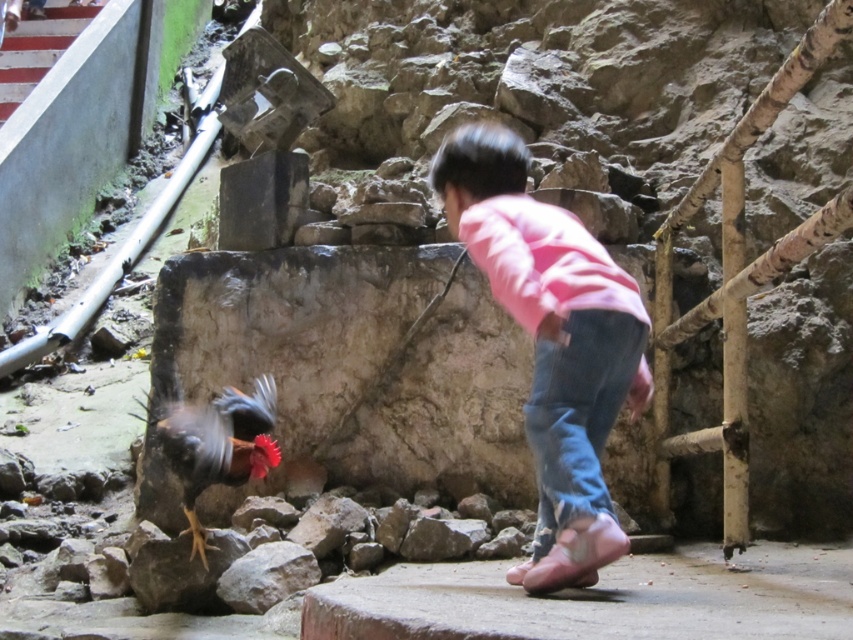
You are a photographer trying to capture the child in the scene. The pink cotton shirt at center and blue denim jeans at lower center are both visible in the frame. Which clothing item is positioned higher relative to the other?

The pink cotton shirt at center is much taller than blue denim jeans at lower center, so the pink cotton shirt at center is positioned higher.

You are a photographer trying to capture the pink cotton shirt at center and the multicolored feathered rooster at center in the same frame. Since the shirt is covering part of the rooster, can you adjust your camera angle to show both clearly without moving any objects?

The pink cotton shirt at center is positioned over the multicolored feathered rooster at center. To capture both clearly, you can lower your camera angle to shoot from below, allowing the shirt to appear slightly raised and revealing more of the rooster beneath it.